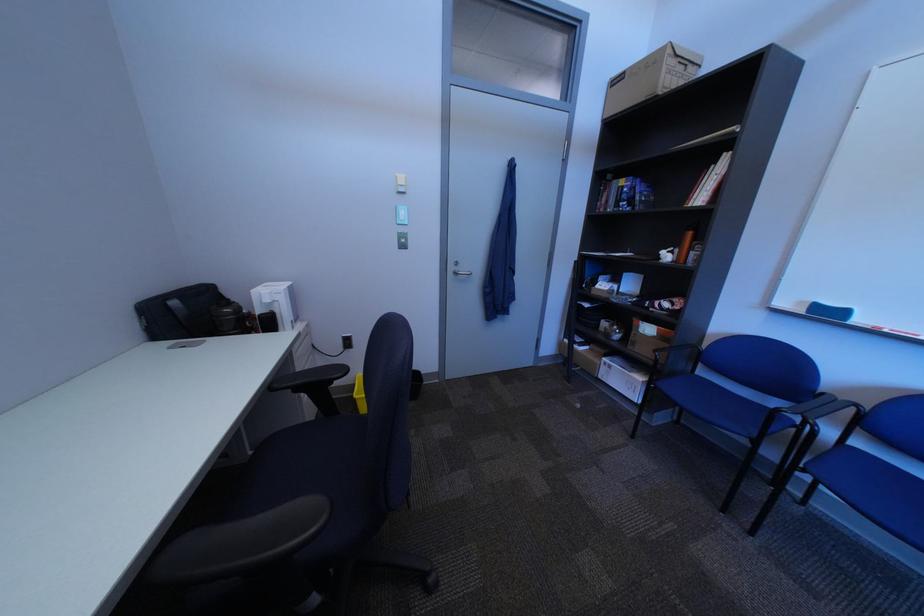
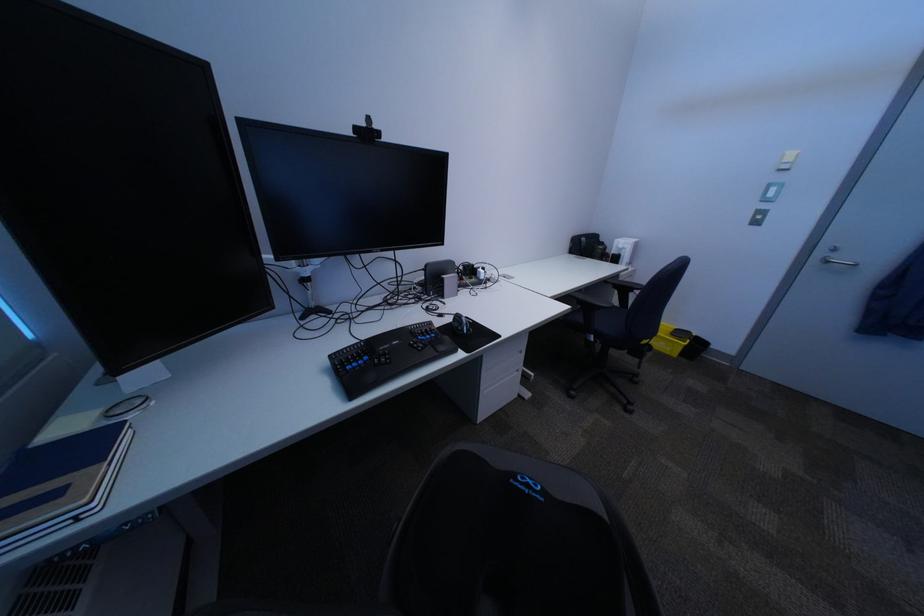
Find the pixel in the second image that matches (305,392) in the first image.

(627, 286)